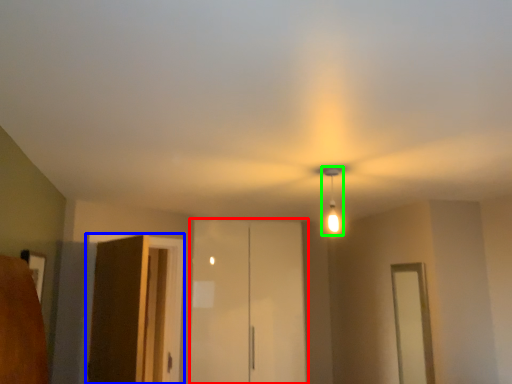
Question: Based on their relative distances, which object is farther from elevator (highlighted by a red box)? Choose from elevator (highlighted by a blue box) and light fixture (highlighted by a green box).

Choices:
 (A) elevator
 (B) light fixture

Answer: (B)